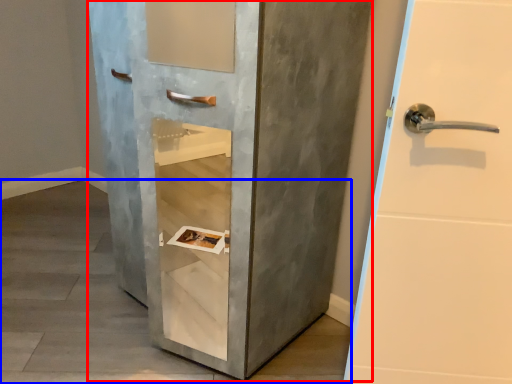
Question: Which point is further to the camera, door (highlighted by a red box) or concrete (highlighted by a blue box)?

Choices:
 (A) door
 (B) concrete

Answer: (B)